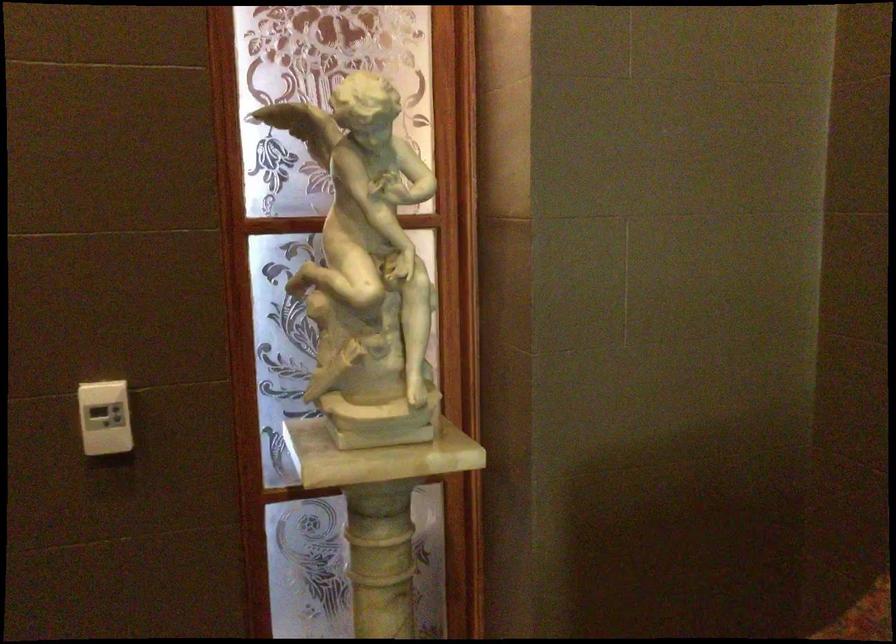
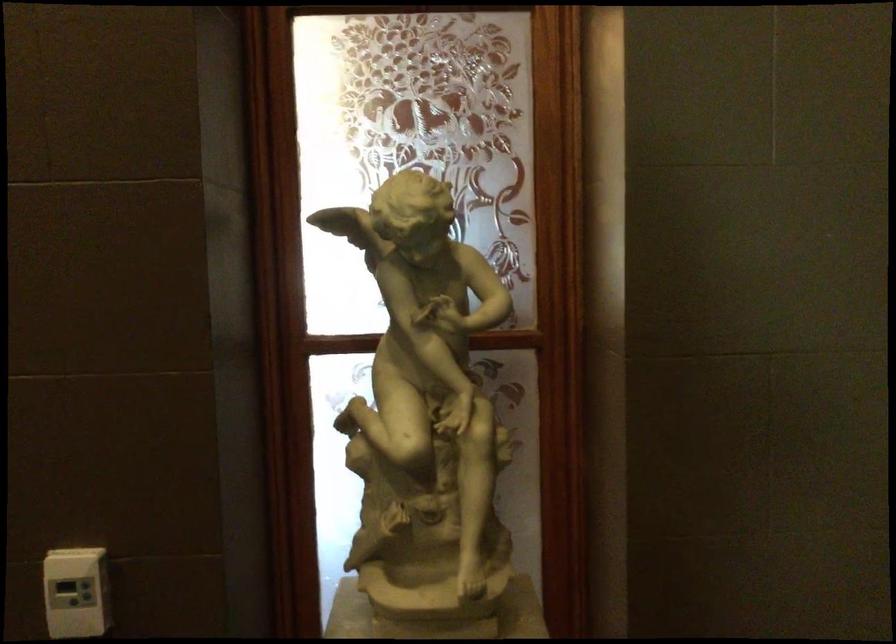
Question: The camera is either moving clockwise (left) or counter-clockwise (right) around the object. The first image is from the beginning of the video and the second image is from the end. Is the camera moving left or right when shooting the video?

Choices:
 (A) Left
 (B) Right

Answer: (B)